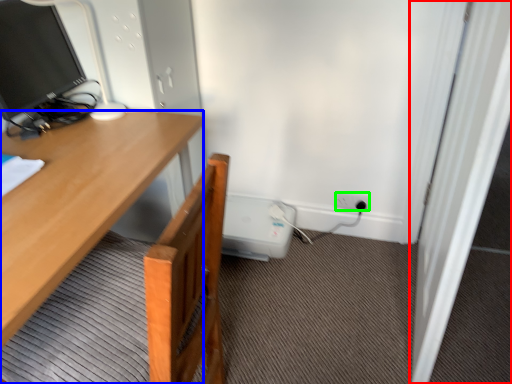
Question: Which object is the farthest from screen door (highlighted by a red box)? Choose among these: desk (highlighted by a blue box) or power outlet (highlighted by a green box).

Choices:
 (A) desk
 (B) power outlet

Answer: (A)